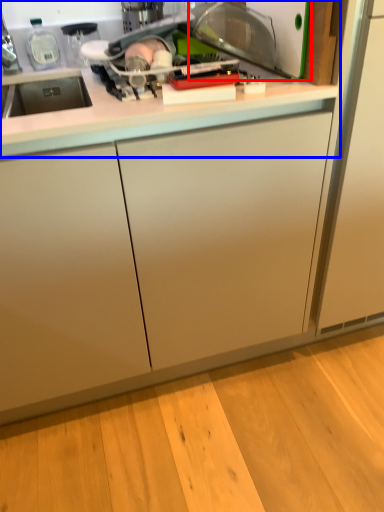
Question: Among these objects, which one is nearest to the camera, appliance (highlighted by a red box) or countertop (highlighted by a blue box)?

Choices:
 (A) appliance
 (B) countertop

Answer: (B)